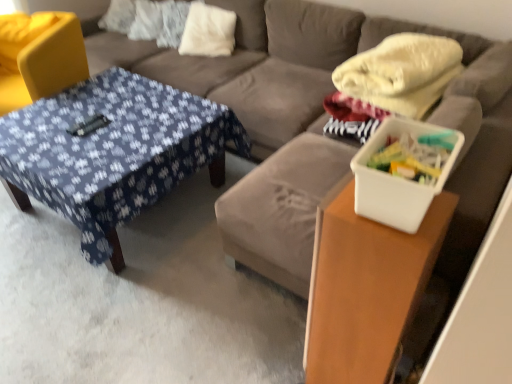
Question: Are white plastic container at right and white soft pillow at upper center making contact?

Choices:
 (A) no
 (B) yes

Answer: (A)

Question: Is white plastic container at right to the right of white soft pillow at upper center from the viewer's perspective?

Choices:
 (A) yes
 (B) no

Answer: (A)

Question: Could you tell me if white plastic container at right is facing white soft pillow at upper center?

Choices:
 (A) yes
 (B) no

Answer: (B)

Question: Can you confirm if white plastic container at right is taller than white soft pillow at upper center?

Choices:
 (A) no
 (B) yes

Answer: (A)

Question: Are white plastic container at right and white soft pillow at upper center far apart?

Choices:
 (A) no
 (B) yes

Answer: (B)

Question: From the image's perspective, relative to blue fabric-covered table at center, marked as the 2th table in a right-to-left arrangement, is yellow fabric swivel chair at left above or below?

Choices:
 (A) below
 (B) above

Answer: (B)

Question: Looking at their shapes, would you say yellow fabric swivel chair at left is wider or thinner than blue fabric-covered table at center, marked as the 2th table in a right-to-left arrangement?

Choices:
 (A) wide
 (B) thin

Answer: (B)

Question: Is point (82, 64) positioned closer to the camera than point (223, 177)?

Choices:
 (A) closer
 (B) farther

Answer: (B)

Question: Is yellow fabric swivel chair at left inside the boundaries of blue fabric-covered table at center, placed as the 1th table when sorted from back to front, or outside?

Choices:
 (A) outside
 (B) inside

Answer: (A)

Question: Is yellow fabric swivel chair at left in front of or behind white plastic container at right in the image?

Choices:
 (A) behind
 (B) front

Answer: (A)

Question: Is yellow fabric swivel chair at left spatially inside white plastic container at right, or outside of it?

Choices:
 (A) outside
 (B) inside

Answer: (A)

Question: From a real-world perspective, is yellow fabric swivel chair at left above or below white plastic container at right?

Choices:
 (A) above
 (B) below

Answer: (B)

Question: In terms of height, does yellow fabric swivel chair at left look taller or shorter compared to white plastic container at right?

Choices:
 (A) tall
 (B) short

Answer: (A)

Question: Looking at their shapes, would you say white plastic container at right is wider or thinner than yellow fabric swivel chair at left?

Choices:
 (A) thin
 (B) wide

Answer: (A)

Question: Do you think white plastic container at right is within yellow fabric swivel chair at left, or outside of it?

Choices:
 (A) outside
 (B) inside

Answer: (A)